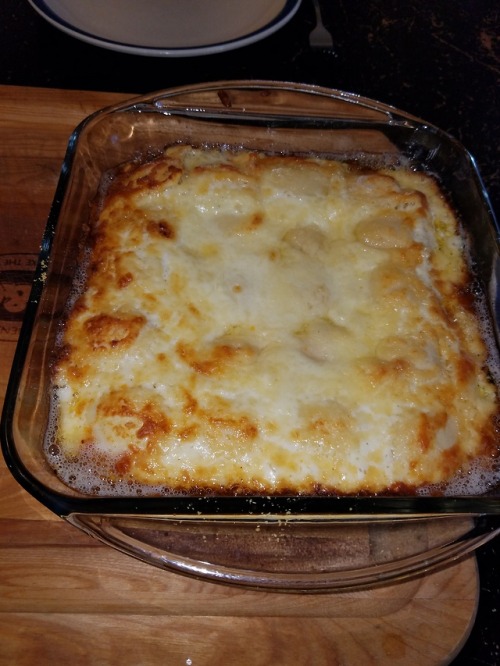
Find the location of a particular element. The width and height of the screenshot is (500, 666). table is located at coordinates pyautogui.click(x=75, y=585).